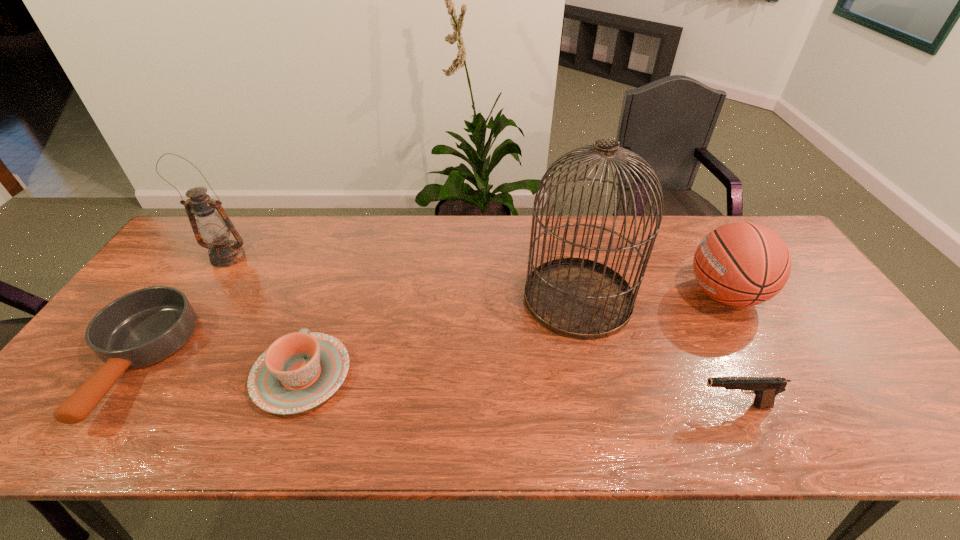
Locate an element on the screen. The image size is (960, 540). birdcage is located at coordinates (578, 298).

Locate an element on the screen. This screenshot has width=960, height=540. the fourth object from left to right is located at coordinates (578, 298).

Identify the location of oil lamp. (213, 226).

Locate an element on the screen. the third tallest object is located at coordinates (741, 264).

Image resolution: width=960 pixels, height=540 pixels. Identify the location of pistol. (765, 389).

This screenshot has height=540, width=960. In order to click on the fourth object from right to left in this screenshot , I will do `click(299, 371)`.

Locate an element on the screen. The height and width of the screenshot is (540, 960). pan is located at coordinates (139, 329).

The height and width of the screenshot is (540, 960). In order to click on vacant area situated 0.090m on the front of the third object from right to left in this screenshot , I will do `click(594, 369)`.

You are a GUI agent. You are given a task and a screenshot of the screen. Output one action in this format:
    pyautogui.click(x=<x>, y=<y>)
    Task: Click on the vacant space located 0.240m on the front of the fifth shortest object
    
    Given the screenshot: What is the action you would take?
    pyautogui.click(x=182, y=328)

Locate an element on the screen. The width and height of the screenshot is (960, 540). vacant space located 0.240m on the logo side of the basketball is located at coordinates (602, 294).